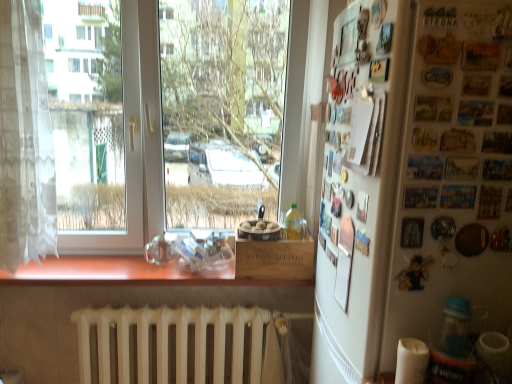
The width and height of the screenshot is (512, 384). Identify the location of free location in front of yellow translucent bottle at center, which is the second bottle in right-to-left order. (294, 236).